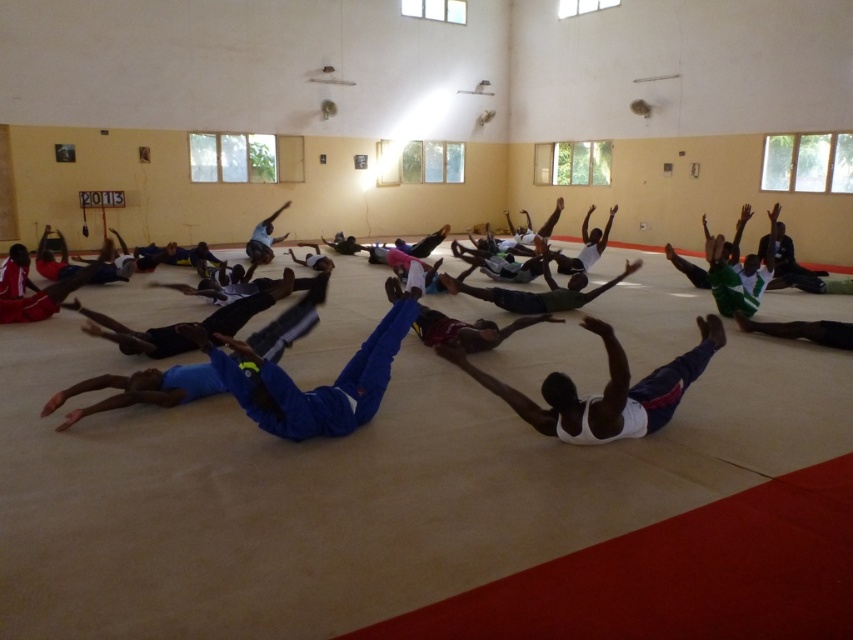
Question: Is blue fabric at center thinner than white tank top at center?

Choices:
 (A) no
 (B) yes

Answer: (A)

Question: Can you confirm if blue fabric at center is wider than white tank top at center?

Choices:
 (A) yes
 (B) no

Answer: (A)

Question: Can you confirm if blue fabric at center is positioned below white tank top at center?

Choices:
 (A) yes
 (B) no

Answer: (B)

Question: Which point is farther to the camera?

Choices:
 (A) blue fabric at center
 (B) white tank top at center

Answer: (A)

Question: Which of the following is the closest to the observer?

Choices:
 (A) white tank top at center
 (B) blue fabric at center

Answer: (A)

Question: Which object appears farthest from the camera in this image?

Choices:
 (A) white tank top at center
 (B) blue fabric at center

Answer: (B)